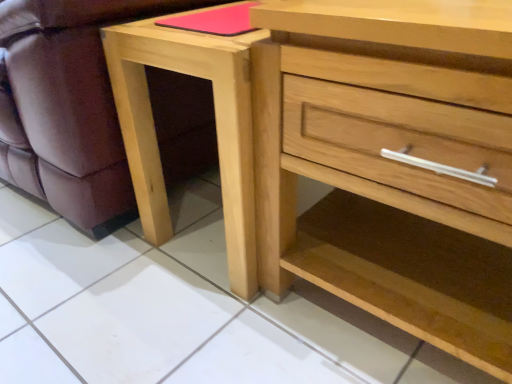
Question: Should I look upward or downward to see natural wood chest of drawers at center?

Choices:
 (A) down
 (B) up

Answer: (B)

Question: Is natural wood chest of drawers at center in front of natural wood nightstand at lower center?

Choices:
 (A) yes
 (B) no

Answer: (A)

Question: Is natural wood chest of drawers at center with natural wood nightstand at lower center?

Choices:
 (A) no
 (B) yes

Answer: (A)

Question: Considering the relative sizes of natural wood chest of drawers at center and natural wood nightstand at lower center in the image provided, is natural wood chest of drawers at center smaller than natural wood nightstand at lower center?

Choices:
 (A) yes
 (B) no

Answer: (B)

Question: Can you confirm if natural wood chest of drawers at center is taller than natural wood nightstand at lower center?

Choices:
 (A) no
 (B) yes

Answer: (B)

Question: Can you confirm if natural wood chest of drawers at center is positioned to the left of natural wood nightstand at lower center?

Choices:
 (A) yes
 (B) no

Answer: (B)

Question: Considering the relative sizes of natural wood chest of drawers at center and natural wood nightstand at lower center in the image provided, is natural wood chest of drawers at center thinner than natural wood nightstand at lower center?

Choices:
 (A) yes
 (B) no

Answer: (B)

Question: From a real-world perspective, is matte wood swivel chair at lower left over natural wood chest of drawers at center?

Choices:
 (A) yes
 (B) no

Answer: (A)

Question: Can you confirm if matte wood swivel chair at lower left is wider than natural wood chest of drawers at center?

Choices:
 (A) yes
 (B) no

Answer: (A)

Question: Considering the relative sizes of matte wood swivel chair at lower left and natural wood chest of drawers at center in the image provided, is matte wood swivel chair at lower left bigger than natural wood chest of drawers at center?

Choices:
 (A) yes
 (B) no

Answer: (A)

Question: Is matte wood swivel chair at lower left oriented away from natural wood chest of drawers at center?

Choices:
 (A) yes
 (B) no

Answer: (B)

Question: Can you confirm if matte wood swivel chair at lower left is shorter than natural wood chest of drawers at center?

Choices:
 (A) yes
 (B) no

Answer: (A)

Question: From a real-world perspective, is matte wood swivel chair at lower left positioned under natural wood chest of drawers at center based on gravity?

Choices:
 (A) no
 (B) yes

Answer: (A)

Question: Does natural wood chest of drawers at center come behind matte wood swivel chair at lower left?

Choices:
 (A) yes
 (B) no

Answer: (B)